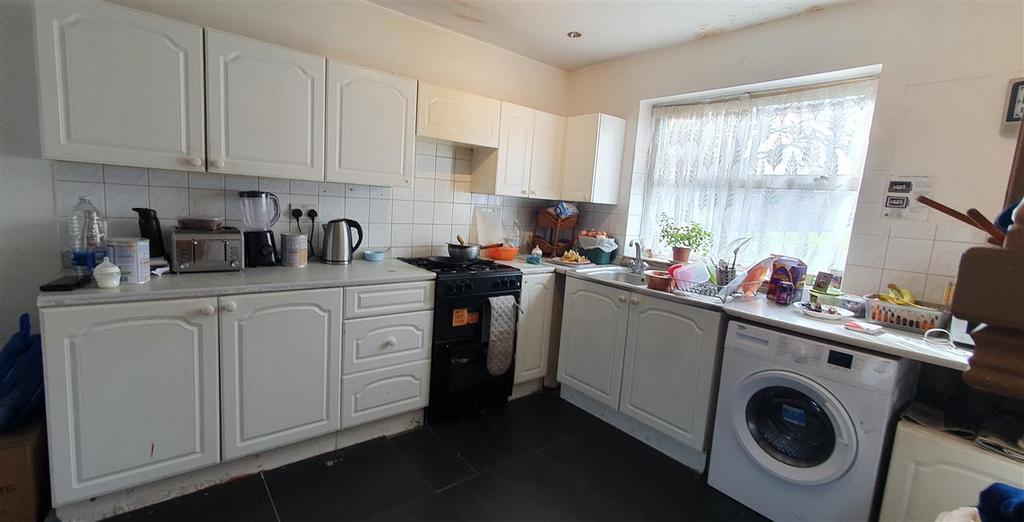
Locate an element on the screen. Image resolution: width=1024 pixels, height=522 pixels. washing machine is located at coordinates (858, 404).